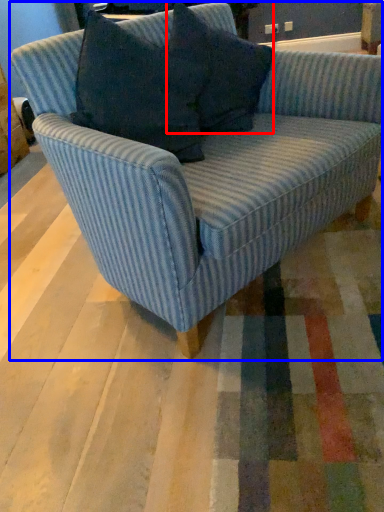
Question: Which object appears farthest to the camera in this image, pillow (highlighted by a red box) or studio couch (highlighted by a blue box)?

Choices:
 (A) pillow
 (B) studio couch

Answer: (A)